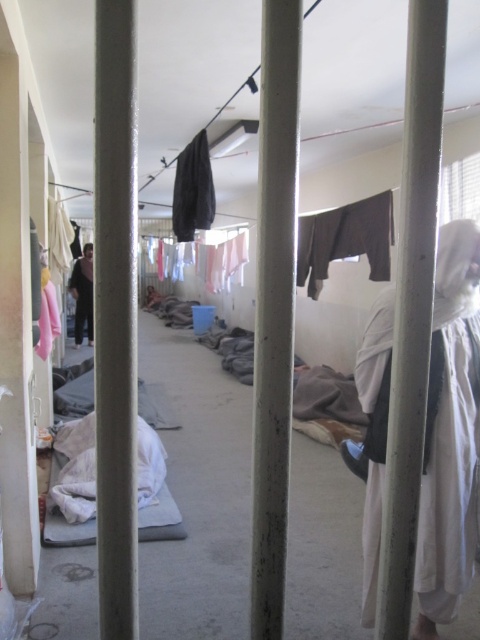
Question: Is white cloth at right wider than white glossy pillar at center?

Choices:
 (A) no
 (B) yes

Answer: (B)

Question: Estimate the real-world distances between objects in this image. Which object is closer to the metallic gray pole at center?

Choices:
 (A) white cloth at right
 (B) dark gray fabric robe at center
 (C) white matte pole at center
 (D) dark gray fabric at center

Answer: (C)

Question: Among these points, which one is farthest from the camera?

Choices:
 (A) (73, 285)
 (B) (121, 173)

Answer: (A)

Question: Can you confirm if white glossy pillar at center is positioned to the left of white fabric clothesline at center?

Choices:
 (A) yes
 (B) no

Answer: (A)

Question: Is white matte pole at center closer to the viewer compared to dark gray fabric robe at center?

Choices:
 (A) no
 (B) yes

Answer: (B)

Question: Which of the following is the closest to the observer?

Choices:
 (A) white fabric clothesline at center
 (B) dark gray fabric robe at center
 (C) white glossy pillar at center
 (D) white matte pole at center

Answer: (C)